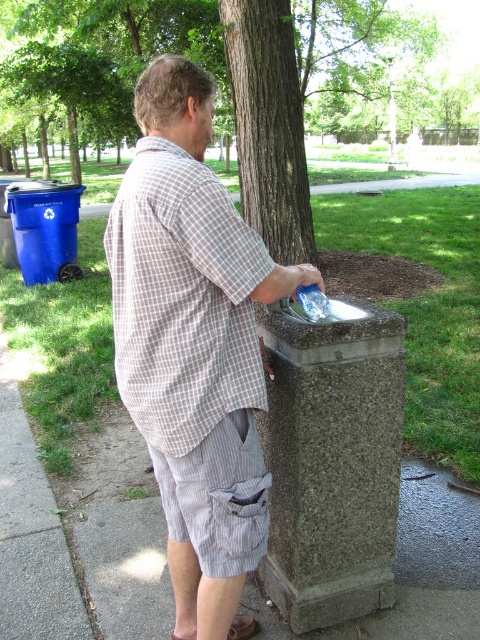
Question: Does checkered fabric shirt at upper left appear on the left side of clear plastic bottle at center?

Choices:
 (A) yes
 (B) no

Answer: (A)

Question: Which of the following is the farthest from the observer?

Choices:
 (A) (133, 176)
 (B) (319, 317)
 (C) (252, 445)

Answer: (B)

Question: Is clear plastic bottle at center to the right of brown leather sandal at lower center from the viewer's perspective?

Choices:
 (A) no
 (B) yes

Answer: (B)

Question: Which of the following is the farthest from the observer?

Choices:
 (A) (264, 520)
 (B) (243, 282)
 (C) (312, 284)

Answer: (C)

Question: Which point is farther to the camera?

Choices:
 (A) gray checkered shirt at center
 (B) clear plastic bottle at center
 (C) brown leather sandal at lower center

Answer: (C)

Question: Does gray checkered shirt at center have a lesser width compared to clear plastic bottle at center?

Choices:
 (A) yes
 (B) no

Answer: (B)